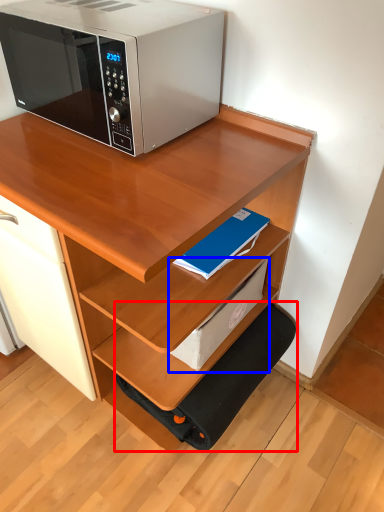
Question: Which of the following is the closest to the observer, step stool (highlighted by a red box) or paperback book (highlighted by a blue box)?

Choices:
 (A) step stool
 (B) paperback book

Answer: (B)